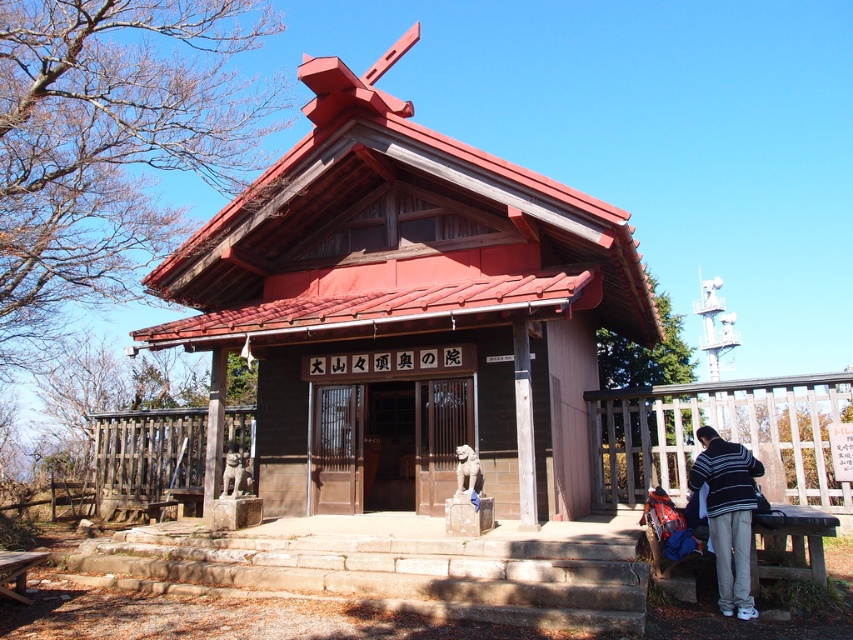
Does striped sweater at lower right appear under brown wooden picnic table at lower left?

Incorrect, striped sweater at lower right is not positioned below brown wooden picnic table at lower left.

The width and height of the screenshot is (853, 640). Find the location of `striped sweater at lower right`. striped sweater at lower right is located at coordinates (728, 515).

The width and height of the screenshot is (853, 640). In order to click on striped sweater at lower right in this screenshot , I will do `click(728, 515)`.

Is wooden temple at center shorter than striped sweater at lower right?

Yes, wooden temple at center is shorter than striped sweater at lower right.

Is point (460, 228) closer to viewer compared to point (740, 529)?

No, it is behind (740, 529).

Locate an element on the screen. wooden temple at center is located at coordinates (405, 308).

Is wooden temple at center to the left of brown wooden picnic table at lower left from the viewer's perspective?

No, wooden temple at center is not to the left of brown wooden picnic table at lower left.

Identify the location of wooden temple at center. Image resolution: width=853 pixels, height=640 pixels. (405, 308).